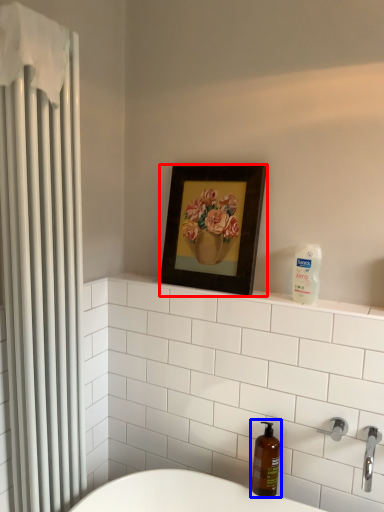
Question: Which object is closer to the camera taking this photo, picture frame (highlighted by a red box) or soap dispenser (highlighted by a blue box)?

Choices:
 (A) picture frame
 (B) soap dispenser

Answer: (B)